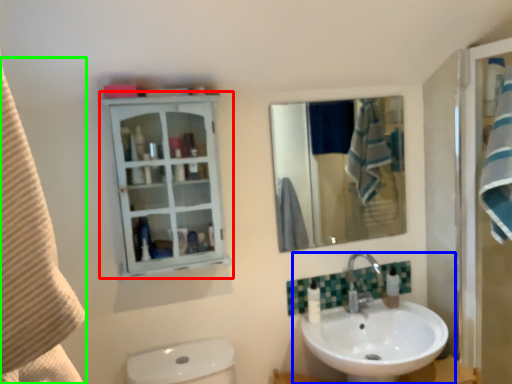
Question: Which object is positioned closest to bathroom cabinet (highlighted by a red box)? Select from sink (highlighted by a blue box) and beach towel (highlighted by a green box).

Choices:
 (A) sink
 (B) beach towel

Answer: (A)